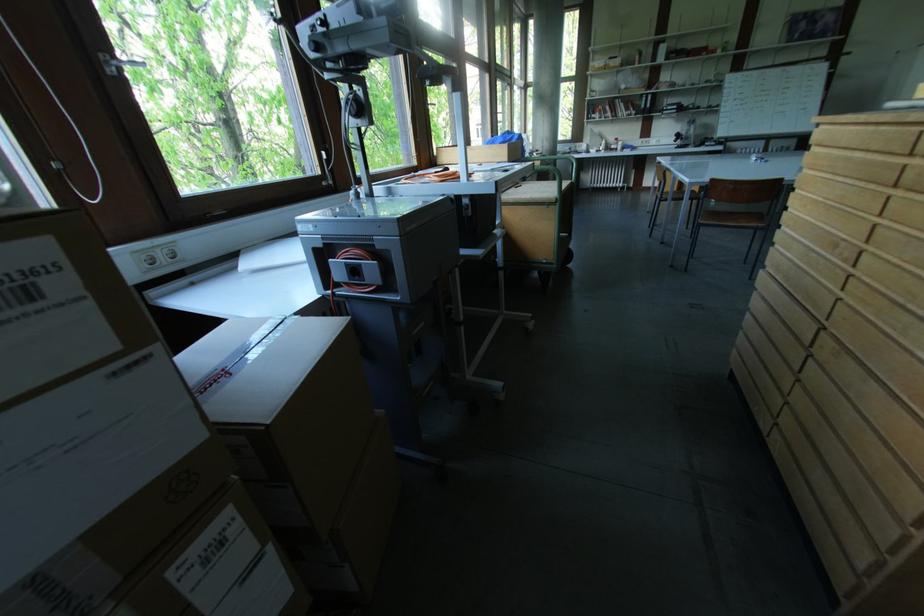
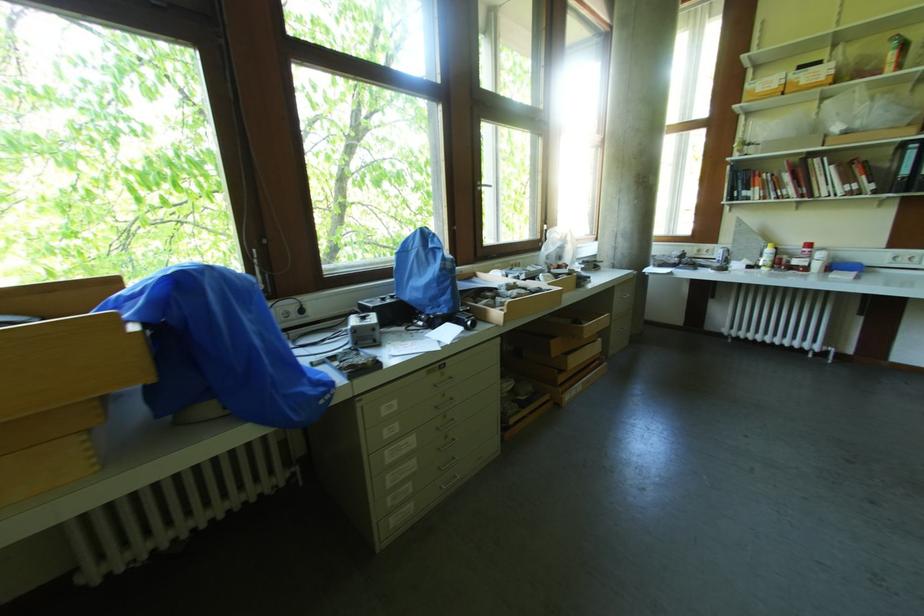
In a continuous first-person perspective shot, in which direction is the camera moving?

The cameraman walked toward right, forward.